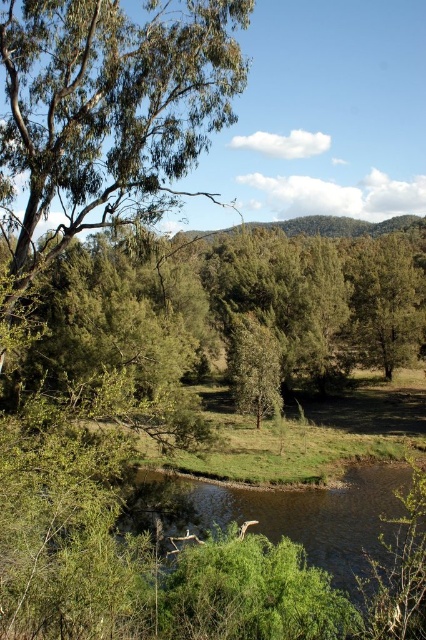
You are a photographer standing at the edge of the river, aiming to capture both the point at coordinates point (143,205) and point (276,538) in your shot. Which point will appear larger in your photo?

Point (143,205) is closer to the camera than point (276,538), so it will appear larger in the photo.